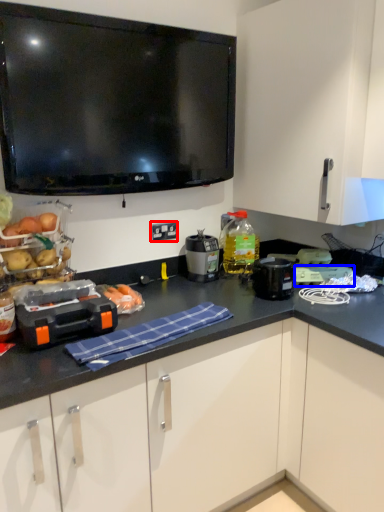
Question: Which object is closer to the camera taking this photo, electric outlet (highlighted by a red box) or appliance (highlighted by a blue box)?

Choices:
 (A) electric outlet
 (B) appliance

Answer: (B)